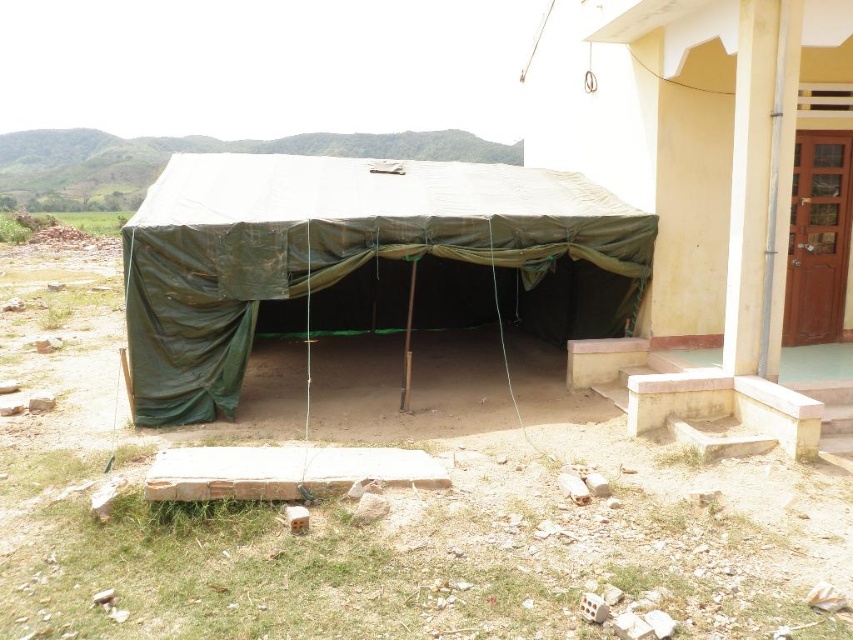
From the picture: Between green tarpaulin tent at lower left and olive green tarpaulin tent at center, which one has less height?

green tarpaulin tent at lower left

Does green tarpaulin tent at lower left appear under olive green tarpaulin tent at center?

Correct, green tarpaulin tent at lower left is located below olive green tarpaulin tent at center.

Does point (793, 404) come behind point (331, 218)?

No, (793, 404) is in front of (331, 218).

This screenshot has width=853, height=640. What are the coordinates of `green tarpaulin tent at lower left` in the screenshot? It's located at (717, 198).